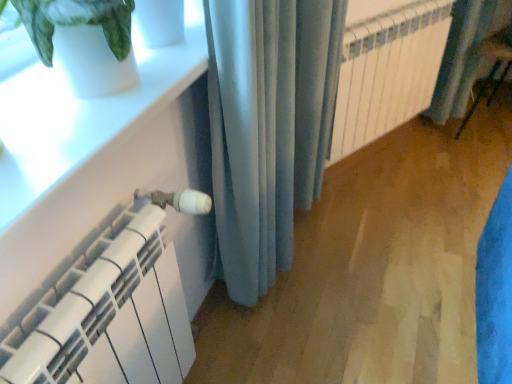
The width and height of the screenshot is (512, 384). I want to click on vacant area located to the right-hand side of satin blue curtain at center, which appears as the first curtain when viewed from the left, so click(x=323, y=303).